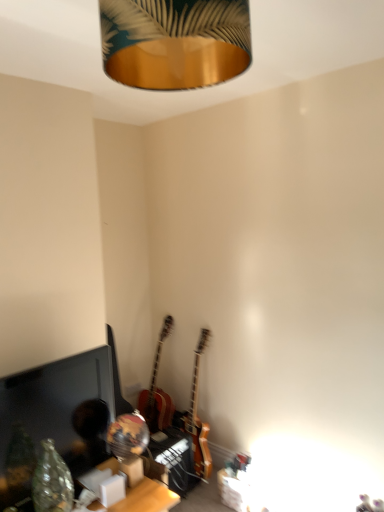
Question: Considering the relative sizes of gold metallic lampshade at upper center and wooden acoustic guitar at center, the first guitar viewed from the left, in the image provided, is gold metallic lampshade at upper center bigger than wooden acoustic guitar at center, the first guitar viewed from the left,?

Choices:
 (A) no
 (B) yes

Answer: (A)

Question: Is wooden acoustic guitar at center, the first guitar viewed from the left, surrounded by gold metallic lampshade at upper center?

Choices:
 (A) no
 (B) yes

Answer: (A)

Question: Considering the relative sizes of gold metallic lampshade at upper center and wooden acoustic guitar at center, the first guitar viewed from the left, in the image provided, is gold metallic lampshade at upper center taller than wooden acoustic guitar at center, the first guitar viewed from the left,?

Choices:
 (A) yes
 (B) no

Answer: (B)

Question: Can you confirm if gold metallic lampshade at upper center is wider than wooden acoustic guitar at center, which is counted as the second guitar, starting from the right?

Choices:
 (A) no
 (B) yes

Answer: (A)

Question: Is gold metallic lampshade at upper center beside wooden acoustic guitar at center, the first guitar viewed from the left?

Choices:
 (A) yes
 (B) no

Answer: (B)

Question: Does gold metallic lampshade at upper center have a lesser height compared to wooden acoustic guitar at center, which is counted as the second guitar, starting from the right?

Choices:
 (A) no
 (B) yes

Answer: (B)

Question: Can you confirm if wooden electric guitar at center, which ranks as the second guitar in left-to-right order, is smaller than matte black monitor at lower left?

Choices:
 (A) yes
 (B) no

Answer: (B)

Question: Does wooden electric guitar at center, the 1th guitar positioned from the right, turn towards matte black monitor at lower left?

Choices:
 (A) yes
 (B) no

Answer: (A)

Question: Is there a large distance between wooden electric guitar at center, which ranks as the second guitar in left-to-right order, and matte black monitor at lower left?

Choices:
 (A) yes
 (B) no

Answer: (B)

Question: Is wooden electric guitar at center, which ranks as the second guitar in left-to-right order, looking in the opposite direction of matte black monitor at lower left?

Choices:
 (A) yes
 (B) no

Answer: (B)

Question: Is wooden electric guitar at center, which ranks as the second guitar in left-to-right order, positioned beyond the bounds of matte black monitor at lower left?

Choices:
 (A) no
 (B) yes

Answer: (B)

Question: Is the depth of wooden electric guitar at center, which ranks as the second guitar in left-to-right order, greater than that of matte black monitor at lower left?

Choices:
 (A) no
 (B) yes

Answer: (B)

Question: Does wooden table at lower center have a smaller size compared to wooden acoustic guitar at center, the first guitar viewed from the left?

Choices:
 (A) yes
 (B) no

Answer: (A)